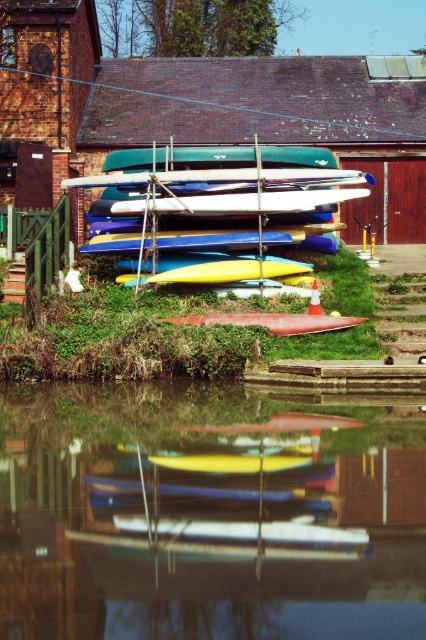
You are standing on the grassy bank next to the canal and want to retrieve the yellow matte kayak at center from its position near the glossy water at lower center. If your reach extends 1.5 meters, can you grab it without entering the water?

The glossy water at lower center is 8.58 meters away from the yellow matte kayak at center. Since your reach only extends 1.5 meters, you cannot grab the yellow matte kayak at center without entering the water.

Consider the image. You are standing at the point marked by the coordinate (213, 204) in the canal scene. What object are you standing on?

The point at coordinate (213, 204) corresponds to the yellow matte kayak at center, so you are standing on the yellow matte kayak at center.

You are a photographer planning to take a photo of the canal scene. You want to ensure that both the glossy water at lower center and the smooth red canoe at center are clearly visible. Based on their sizes in the image, which object should you focus on first to ensure proper framing?

The smooth red canoe at center is larger than the glossy water at lower center, so focusing on the smooth red canoe at center first will help ensure proper framing for both objects.